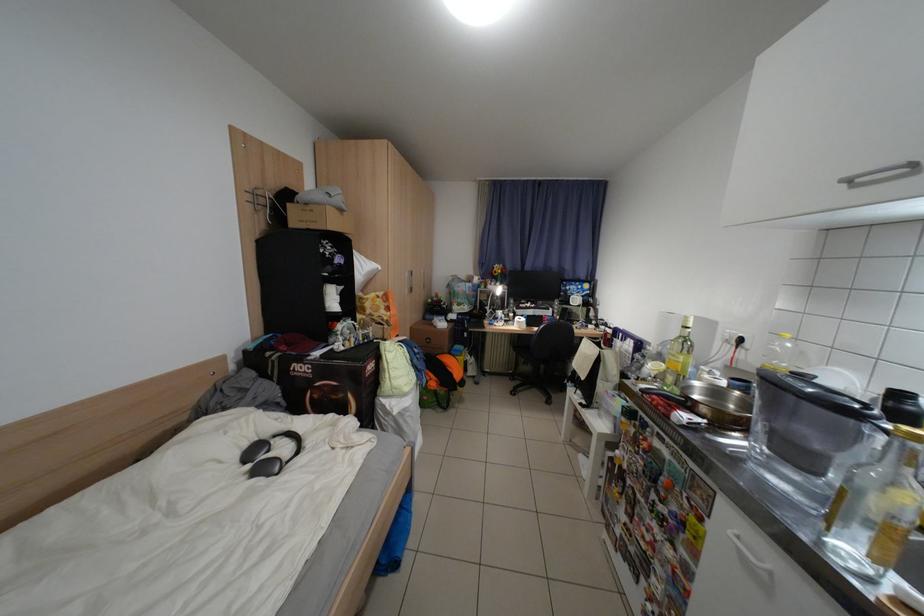
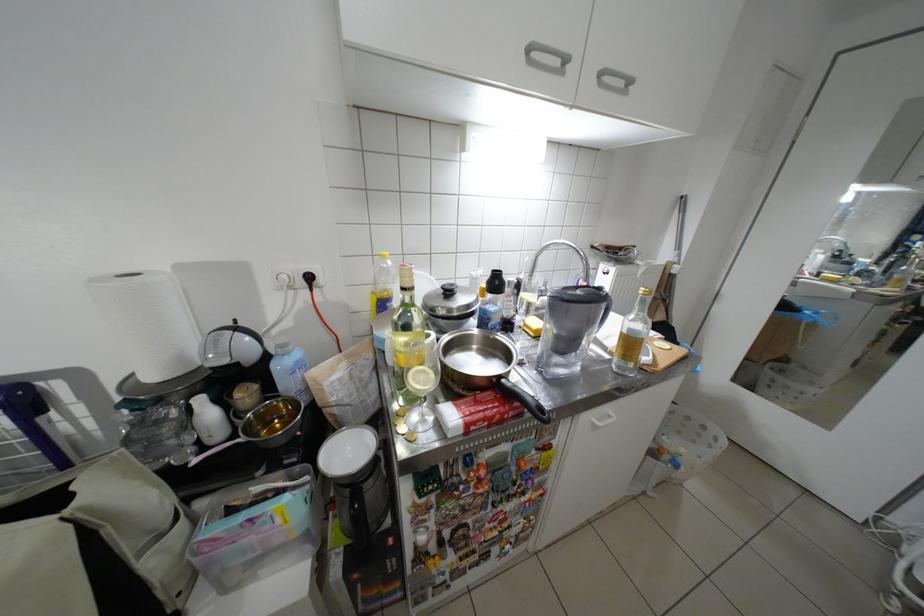
The point at [801,346] is marked in the first image. Where is the corresponding point in the second image?

(400, 264)